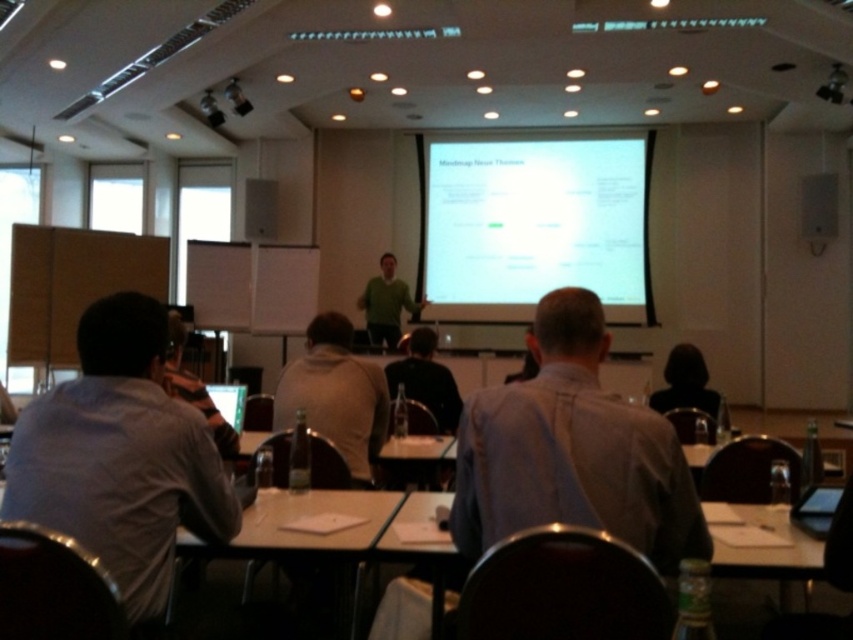
You are an attendee sitting in the conference room and want to read the text on the white matte projection screen at upper center. Can you see the text clearly while standing up from your seat next to the gray cotton shirt at center?

The white matte projection screen at upper center is located above the gray cotton shirt at center. Since the shirt is at the center and the screen is above it, standing up might allow you to see the text on the white matte projection screen at upper center more clearly by avoiding obstruction from the gray cotton shirt at center.

You are an attendee sitting in the conference room and want to read the text displayed on the white matte projection screen at upper center. Considering the distance, can you clearly see the text from your seat?

The white matte projection screen at upper center is 29.34 feet away from the viewer. Whether the text is clearly visible depends on factors like the screen size, font size, and lighting conditions, but the distance itself does not inherently prevent clear visibility.

You are an attendee sitting in the conference room and want to read the text on the white matte projection screen at upper center. The presenter is wearing a dark gray shirt at center. Which direction should you look to focus on the screen while keeping the presenter in your peripheral vision?

You should look to the right because the white matte projection screen at upper center is to the right of the dark gray shirt at center, which the presenter is wearing.